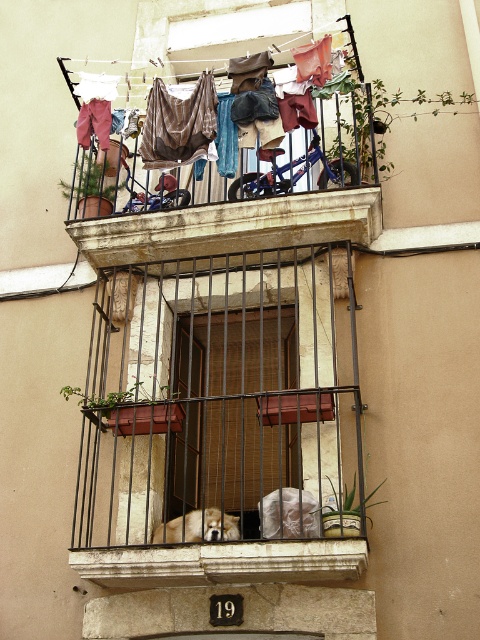
Can you confirm if brown fabric pants at upper center is positioned above fuzzy beige dog at lower center?

Indeed, brown fabric pants at upper center is positioned over fuzzy beige dog at lower center.

The height and width of the screenshot is (640, 480). What are the coordinates of `brown fabric pants at upper center` in the screenshot? It's located at (257, 120).

Is point (274, 83) behind point (167, 525)?

Yes, point (274, 83) is farther from viewer.

This screenshot has height=640, width=480. Identify the location of brown fabric pants at upper center. (257, 120).

Between rustic stone balcony at center and brown fabric pants at upper center, which one appears on the right side from the viewer's perspective?

Positioned to the right is brown fabric pants at upper center.

Who is lower down, rustic stone balcony at center or brown fabric pants at upper center?

rustic stone balcony at center is lower down.

At what (x,y) coordinates should I click in order to perform the action: click on rustic stone balcony at center. Please return your answer as a coordinate pair (x, y). Looking at the image, I should click on (222, 419).

Between rustic stone balcony at center and white stone window sill at lower center, which one appears on the left side from the viewer's perspective?

white stone window sill at lower center

Consider the image. Which of these two, rustic stone balcony at center or white stone window sill at lower center, stands taller?

rustic stone balcony at center

The height and width of the screenshot is (640, 480). What are the coordinates of `rustic stone balcony at center` in the screenshot? It's located at (222, 419).